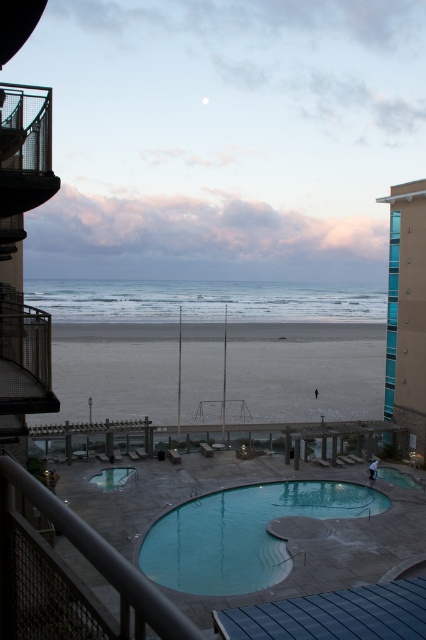
Based on the photo, you are standing at the point with coordinates point (x=406, y=310). Which object are you on?

You are on the teal glass building at right.

You are standing on the beach and want to get to the smooth blue pool at center. There is a metallic balcony at left blocking your path. Which direction should you walk to avoid the balcony?

You should walk to the right side of the metallic balcony at left to reach the smooth blue pool at center since the balcony is positioned to the left of the pool.